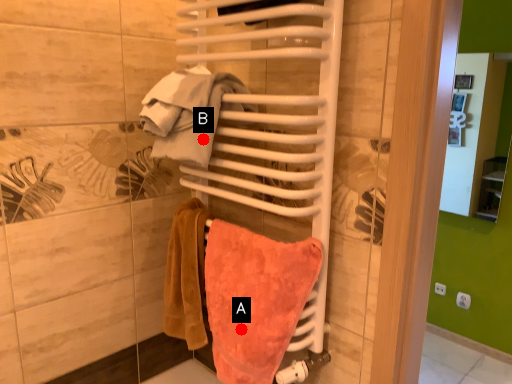
Question: Two points are circled on the image, labeled by A and B beside each circle. Which point is closer to the camera?

Choices:
 (A) A is closer
 (B) B is closer

Answer: (B)